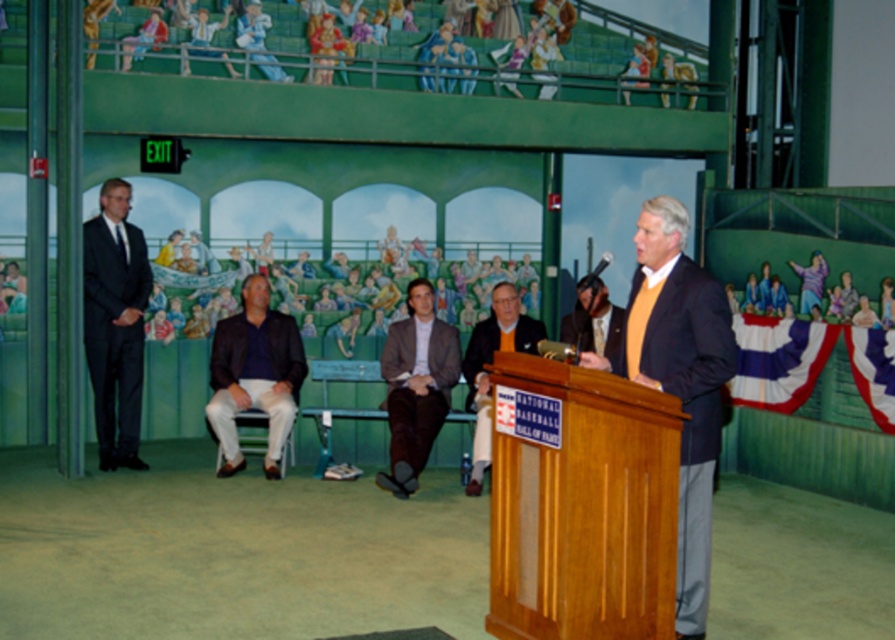
Question: Estimate the real-world distances between objects in this image. Which object is closer to the matte black suit at center?

Choices:
 (A) dark blue shirt at center
 (B) dark gray suit at left
 (C) orange sweater at center
 (D) brown suede jacket at center

Answer: (C)

Question: Is dark gray suit at left smaller than dark blue shirt at center?

Choices:
 (A) no
 (B) yes

Answer: (B)

Question: Which point is closer to the camera?

Choices:
 (A) (700, 532)
 (B) (107, 220)
 (C) (619, 369)

Answer: (A)

Question: Can you confirm if brown suede jacket at center is positioned to the right of matte black suit at center?

Choices:
 (A) no
 (B) yes

Answer: (A)

Question: Is dark gray suit at left below matte black suit at center?

Choices:
 (A) no
 (B) yes

Answer: (A)

Question: Which object is closer to the camera taking this photo?

Choices:
 (A) dark blue shirt at center
 (B) matte orange sweater at center

Answer: (B)